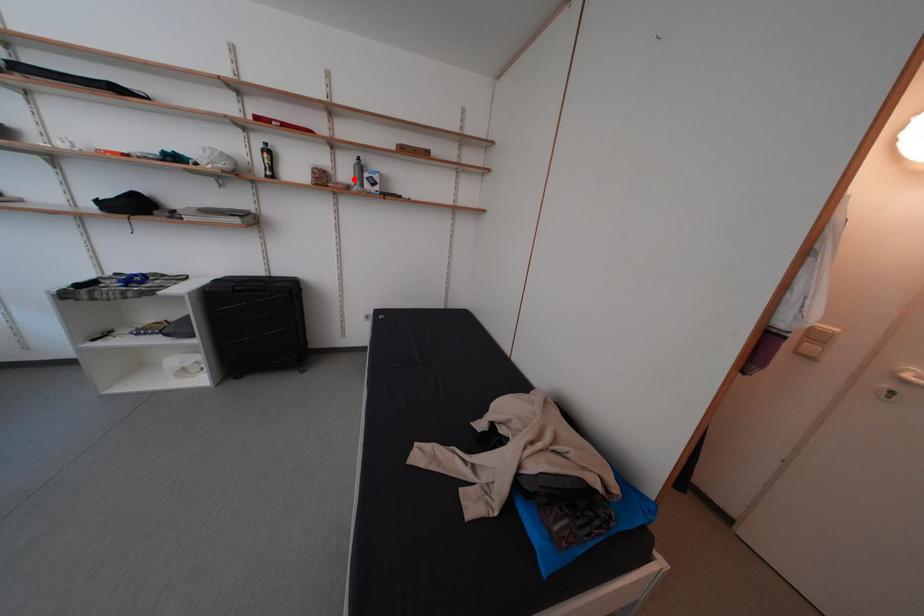
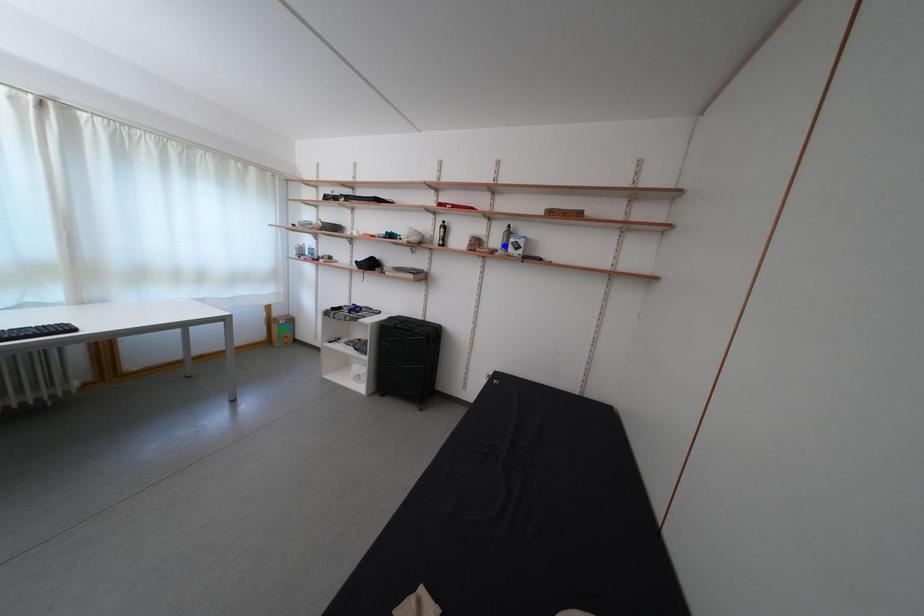
Question: I am providing you with two images of the same scene from different viewpoints. A red point is marked on the first image. You are given multiple points on the second image. Which spot in image 2 lines up with the point in image 1?

Choices:
 (A) yellow point
 (B) blue point
 (C) green point

Answer: (B)